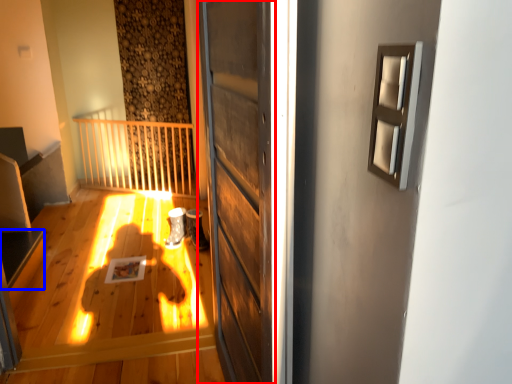
Question: Among these objects, which one is nearest to the camera, door (highlighted by a red box) or stairwell (highlighted by a blue box)?

Choices:
 (A) door
 (B) stairwell

Answer: (A)